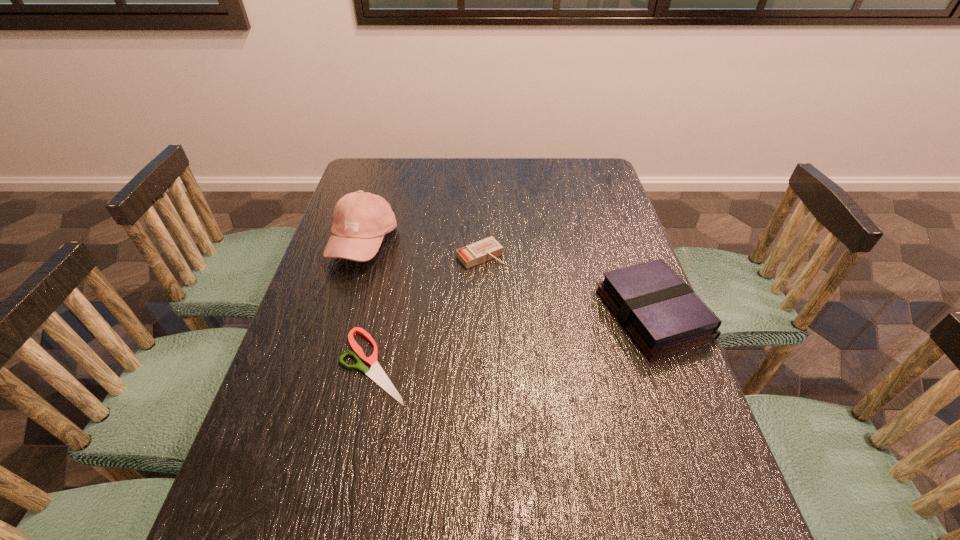
Locate an element on the screen. This screenshot has width=960, height=540. unoccupied position between the tallest object and the shortest object is located at coordinates (369, 305).

The image size is (960, 540). What are the coordinates of `free spot between the matchbox and the second tallest object` in the screenshot? It's located at (566, 285).

Find the location of `the closest object to the second object from right to left`. the closest object to the second object from right to left is located at coordinates [x=361, y=219].

Identify which object is located as the second nearest to the third object from left to right. Please provide its 2D coordinates. Your answer should be formatted as a tuple, i.e. [(x, y)], where the tuple contains the x and y coordinates of a point satisfying the conditions above.

[(660, 312)]

In order to click on blank area in the image that satisfies the following two spatial constraints: 1. on the front side of the second shortest object; 2. on the right side of the baseball cap in this screenshot , I will do `click(360, 255)`.

Where is `blank area in the image that satisfies the following two spatial constraints: 1. on the front side of the third object from left to right; 2. on the left side of the rightmost object`? The width and height of the screenshot is (960, 540). blank area in the image that satisfies the following two spatial constraints: 1. on the front side of the third object from left to right; 2. on the left side of the rightmost object is located at coordinates (480, 314).